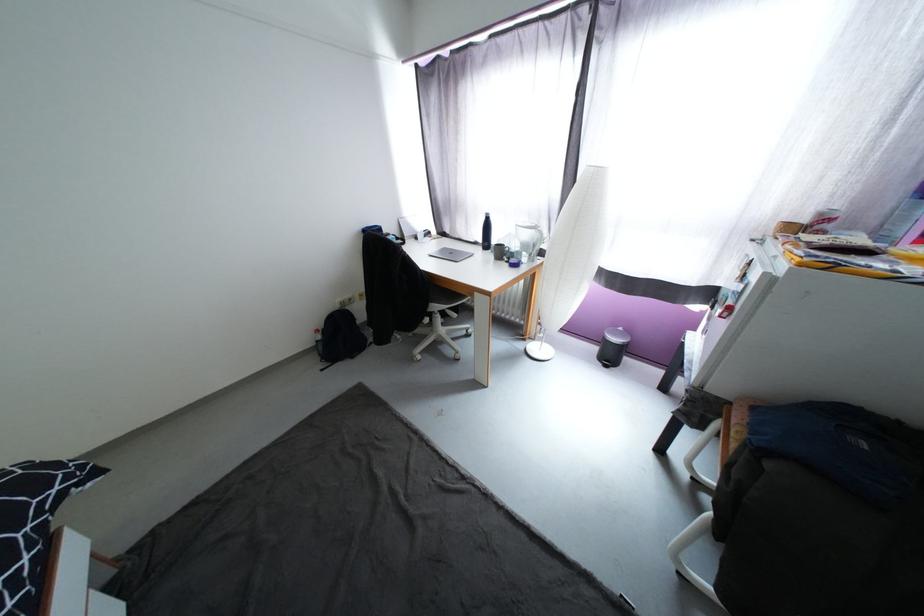
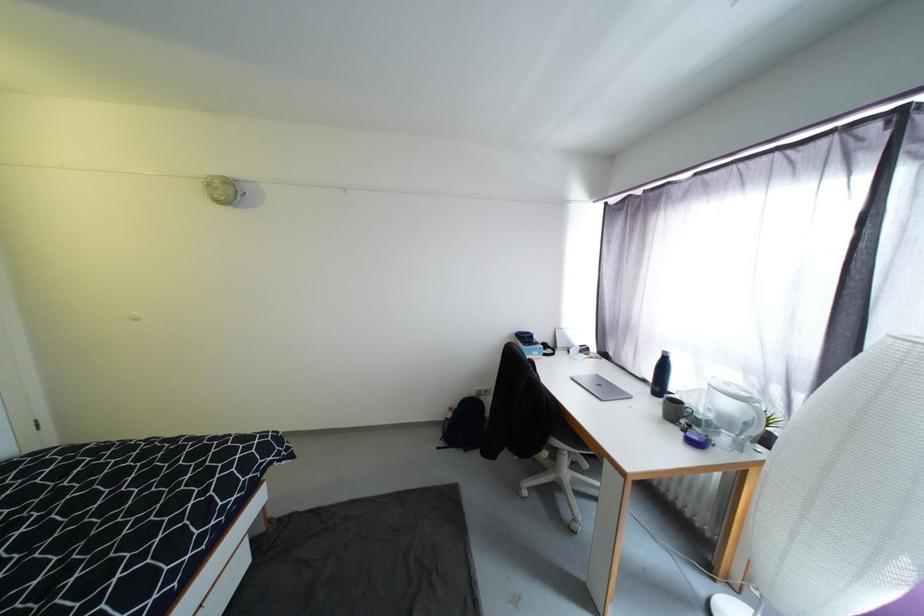
Question: How did the camera likely rotate?

Choices:
 (A) Left
 (B) Right
 (C) Up
 (D) Down

Answer: (A)